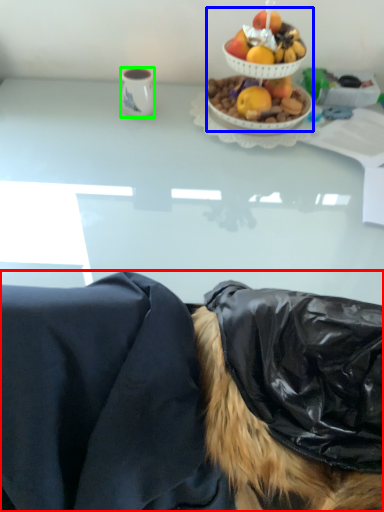
Question: Based on their relative distances, which object is farther from person (highlighted by a red box)? Choose from fruit salad (highlighted by a blue box) and coffee cup (highlighted by a green box).

Choices:
 (A) fruit salad
 (B) coffee cup

Answer: (B)